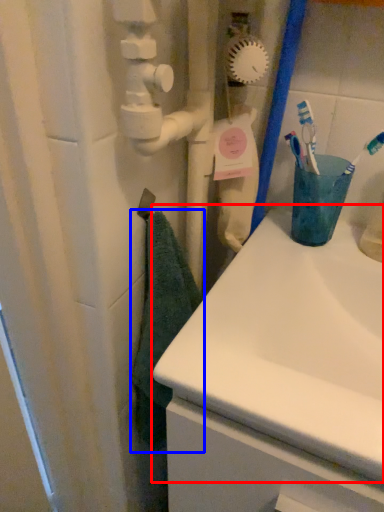
Question: Which object is further to the camera taking this photo, sink (highlighted by a red box) or bath towel (highlighted by a blue box)?

Choices:
 (A) sink
 (B) bath towel

Answer: (B)